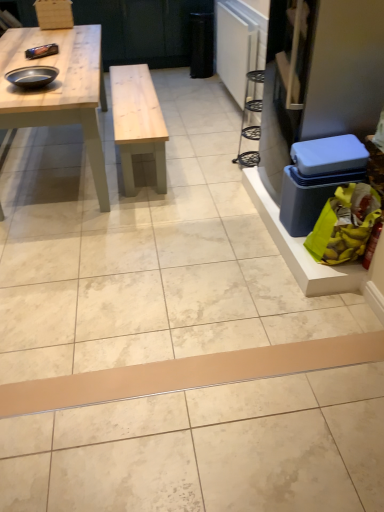
Question: In terms of size, does black matte bowl at upper left appear bigger or smaller than beige matte plank at center?

Choices:
 (A) big
 (B) small

Answer: (B)

Question: Is black matte bowl at upper left taller or shorter than beige matte plank at center?

Choices:
 (A) tall
 (B) short

Answer: (B)

Question: Which object is the closest to the blue plastic box at right?

Choices:
 (A) yellow plastic bag at lower right
 (B) beige matte plank at center
 (C) light wood table at upper left
 (D) black matte bowl at upper left

Answer: (A)

Question: Which is farther from the blue plastic box at right?

Choices:
 (A) beige matte plank at center
 (B) black matte bowl at upper left
 (C) yellow plastic bag at lower right
 (D) light wood table at upper left

Answer: (B)